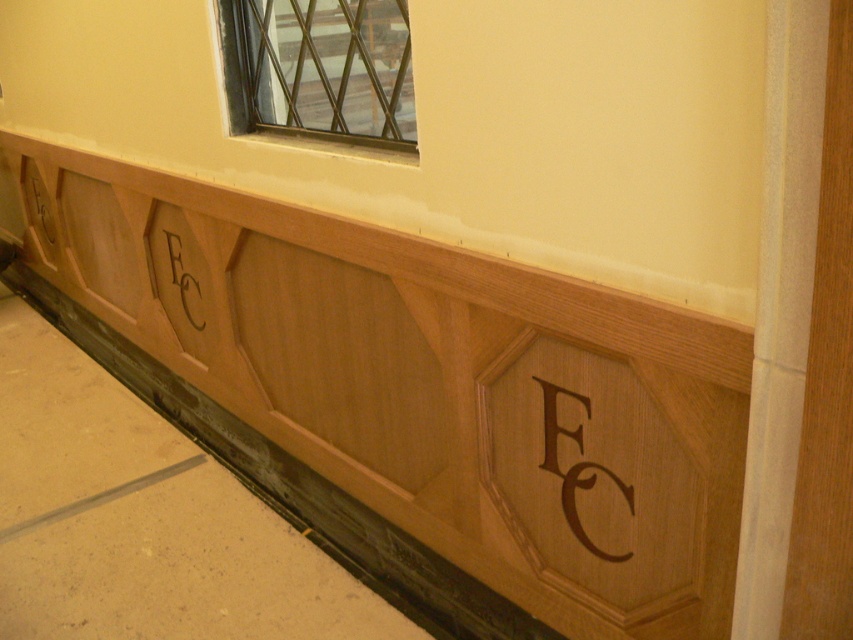
You are an architect designing a new building and want to place a decorative element exactly at the center of the wall. The wall has a metallic grid at upper center. Based on the image, where should you place your decorative element to ensure it aligns with the central axis of the wall?

The metallic grid at upper center is positioned at point (320,72), so you should place your decorative element at that coordinate to align it with the central axis of the wall.

You are an interior designer planning to install a new light fixture. You have two options for placement based on the wall design. The first option is above the brown wood lettering at center, and the second is above the black wood lettering at center. Which placement would allow for a wider light fixture?

The black wood lettering at center is thicker than the brown wood lettering at center, so placing the light fixture above the black wood lettering at center would accommodate a wider fixture.

You are an interior designer who wants to hang a picture frame exactly between the brown wood lettering at center and the black wood lettering at center. Since both are at the center, which one should you use as a reference point to ensure the frame is centered properly?

The brown wood lettering at center is positioned on the right side of black wood lettering at center, so you should use the midpoint between them as the reference point to center the picture frame properly.